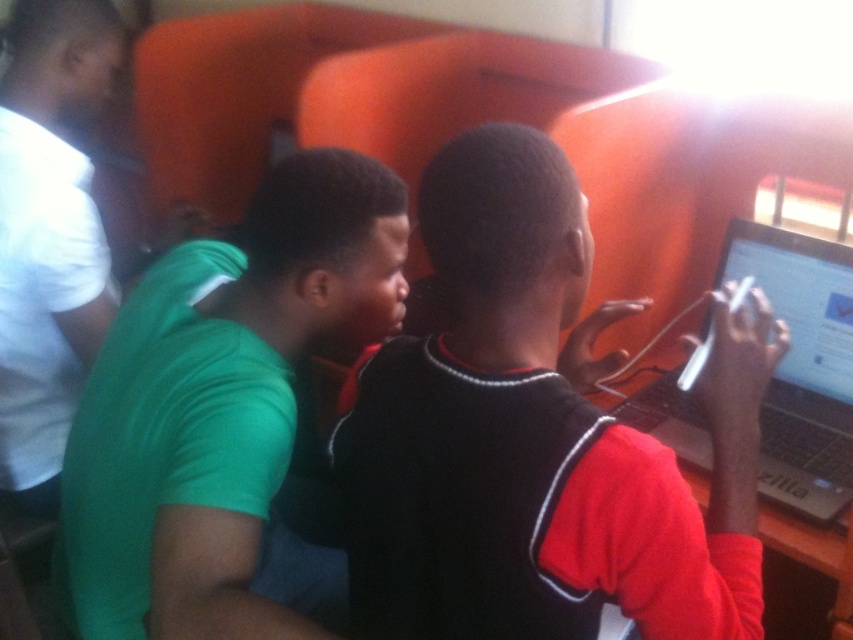
Question: Estimate the real-world distances between objects in this image. Which object is closer to the white matte shirt at left?

Choices:
 (A) green matte shirt at center
 (B) silver/black laptop at right
 (C) black matte shirt at center

Answer: (A)

Question: Is black matte shirt at center further to the viewer compared to green matte shirt at center?

Choices:
 (A) yes
 (B) no

Answer: (B)

Question: Which of the following is the farthest from the observer?

Choices:
 (A) (846, 380)
 (B) (440, 420)
 (C) (55, 129)

Answer: (C)

Question: Does green matte shirt at center come behind silver/black laptop at right?

Choices:
 (A) yes
 (B) no

Answer: (B)

Question: Can you confirm if black matte shirt at center is positioned to the left of green matte shirt at center?

Choices:
 (A) no
 (B) yes

Answer: (A)

Question: Which object is the farthest from the green matte shirt at center?

Choices:
 (A) black matte shirt at center
 (B) silver/black laptop at right

Answer: (B)